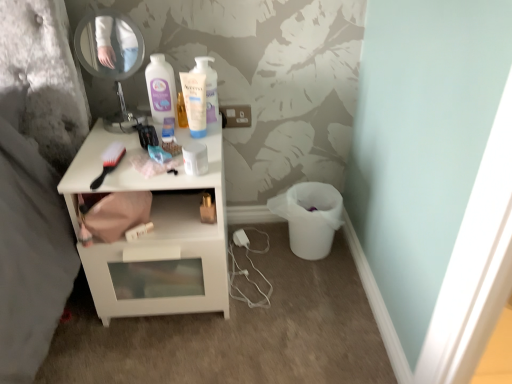
This screenshot has height=384, width=512. Describe the element at coordinates (154, 237) in the screenshot. I see `white glossy nightstand at center` at that location.

Identify the location of black plastic brush at upper left. The height and width of the screenshot is (384, 512). (109, 162).

The image size is (512, 384). Describe the element at coordinates (109, 162) in the screenshot. I see `black plastic brush at upper left` at that location.

Find the location of a particular element. The height and width of the screenshot is (384, 512). metallic round mirror at upper left is located at coordinates tap(110, 52).

Is black plastic brush at upper left oriented towards white glossy nightstand at center?

No, black plastic brush at upper left is not aimed at white glossy nightstand at center.

Locate an element on the screen. This screenshot has height=384, width=512. nightstand below the black plastic brush at upper left (from the image's perspective) is located at coordinates (154, 237).

Based on their positions, is white glossy nightstand at center located to the left or right of metallic round mirror at upper left?

From the image, it's evident that white glossy nightstand at center is to the right of metallic round mirror at upper left.

Considering the sizes of white glossy nightstand at center and metallic round mirror at upper left in the image, is white glossy nightstand at center taller or shorter than metallic round mirror at upper left?

white glossy nightstand at center is taller than metallic round mirror at upper left.

From the image's perspective, is white glossy nightstand at center over metallic round mirror at upper left?

Incorrect, from the image's perspective, white glossy nightstand at center is lower than metallic round mirror at upper left.

Considering the relative sizes of white glossy nightstand at center and metallic round mirror at upper left in the image provided, is white glossy nightstand at center smaller than metallic round mirror at upper left?

Incorrect, white glossy nightstand at center is not smaller in size than metallic round mirror at upper left.

From the image's perspective, which is below, white glossy nightstand at center or black plastic brush at upper left?

white glossy nightstand at center appears lower in the image.

Does white glossy nightstand at center turn towards black plastic brush at upper left?

No, white glossy nightstand at center does not turn towards black plastic brush at upper left.

Consider the image. Considering the sizes of white glossy nightstand at center and black plastic brush at upper left in the image, is white glossy nightstand at center wider or thinner than black plastic brush at upper left?

white glossy nightstand at center is wider than black plastic brush at upper left.

Could black plastic brush at upper left be considered to be inside white glossy nightstand at center?

Yes, white glossy nightstand at center contains black plastic brush at upper left.

From the image's perspective, is metallic round mirror at upper left above black plastic brush at upper left?

Yes, from the image's perspective, metallic round mirror at upper left is on top of black plastic brush at upper left.

Is metallic round mirror at upper left next to black plastic brush at upper left and touching it?

No, metallic round mirror at upper left is not beside black plastic brush at upper left.

From a real-world perspective, is metallic round mirror at upper left located higher than black plastic brush at upper left?

Yes.

Would you say black plastic brush at upper left is part of metallic round mirror at upper left's contents?

No, metallic round mirror at upper left does not contain black plastic brush at upper left.

Can you confirm if metallic round mirror at upper left is positioned to the left of white glossy nightstand at center?

Indeed, metallic round mirror at upper left is positioned on the left side of white glossy nightstand at center.

Can you confirm if metallic round mirror at upper left is bigger than white glossy nightstand at center?

Incorrect, metallic round mirror at upper left is not larger than white glossy nightstand at center.

Who is taller, metallic round mirror at upper left or white glossy nightstand at center?

white glossy nightstand at center is taller.

Is metallic round mirror at upper left thinner than white glossy nightstand at center?

Yes, metallic round mirror at upper left is thinner than white glossy nightstand at center.

Is the depth of black plastic brush at upper left less than that of metallic round mirror at upper left?

Yes, black plastic brush at upper left is closer to the viewer.

Between point (90, 188) and point (119, 99), which one is positioned behind?

Positioned behind is point (119, 99).

Are black plastic brush at upper left and metallic round mirror at upper left beside each other?

They are not placed beside each other.

In order to click on nightstand located on the right of black plastic brush at upper left in this screenshot , I will do pos(154,237).

Identify the location of nightstand that is under the metallic round mirror at upper left (from a real-world perspective). (154, 237).

Which object lies further to the anchor point metallic round mirror at upper left, white glossy nightstand at center or black plastic brush at upper left?

white glossy nightstand at center.

When comparing their distances from white glossy nightstand at center, does black plastic brush at upper left or metallic round mirror at upper left seem closer?

black plastic brush at upper left is closer to white glossy nightstand at center.

Looking at this image, considering their positions, is black plastic brush at upper left positioned closer to metallic round mirror at upper left than white glossy nightstand at center?

black plastic brush at upper left.

Which object lies nearer to the anchor point white glossy nightstand at center, metallic round mirror at upper left or black plastic brush at upper left?

Based on the image, black plastic brush at upper left appears to be nearer to white glossy nightstand at center.

Based on their spatial positions, is metallic round mirror at upper left or white glossy nightstand at center further from black plastic brush at upper left?

Among the two, metallic round mirror at upper left is located further to black plastic brush at upper left.

When comparing their distances from black plastic brush at upper left, does white glossy nightstand at center or metallic round mirror at upper left seem closer?

white glossy nightstand at center is positioned closer to the anchor black plastic brush at upper left.

Image resolution: width=512 pixels, height=384 pixels. I want to click on brush between metallic round mirror at upper left and white glossy nightstand at center vertically, so click(109, 162).